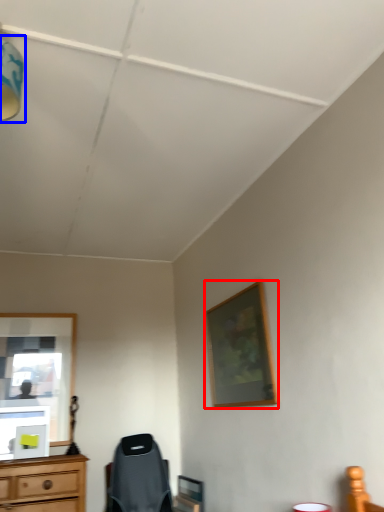
Question: Which object is further to the camera taking this photo, picture frame (highlighted by a red box) or light fixture (highlighted by a blue box)?

Choices:
 (A) picture frame
 (B) light fixture

Answer: (A)